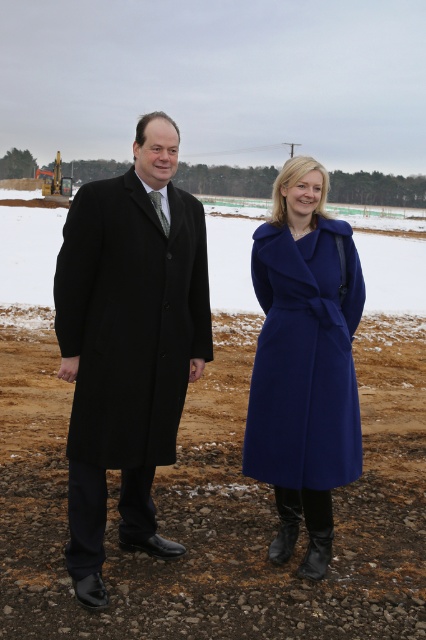
You are an architect designing a new pathway for the construction site shown. The pathway must be placed above the brown gravel at center. Where should you position the pathway in relation to the black wool coat at center?

The pathway should be positioned above the black wool coat at center since the brown gravel at center is located below it, and the pathway needs to be above the gravel.

You are a photographer trying to capture a closeup of the black wool coat at center and the matte blue coat at center. Given that your camera can focus on objects within a 20 inch range, can you capture both coats in a single focused shot?

The black wool coat at center is 24.23 inches away from the matte blue coat at center, which exceeds the camera focus range of 20 inches. Therefore, you cannot capture both coats in a single focused shot.

Consider the image. What is located at the coordinates point (218, 506) in the image?

The coordinates point (218, 506) corresponds to brown gravel at center.